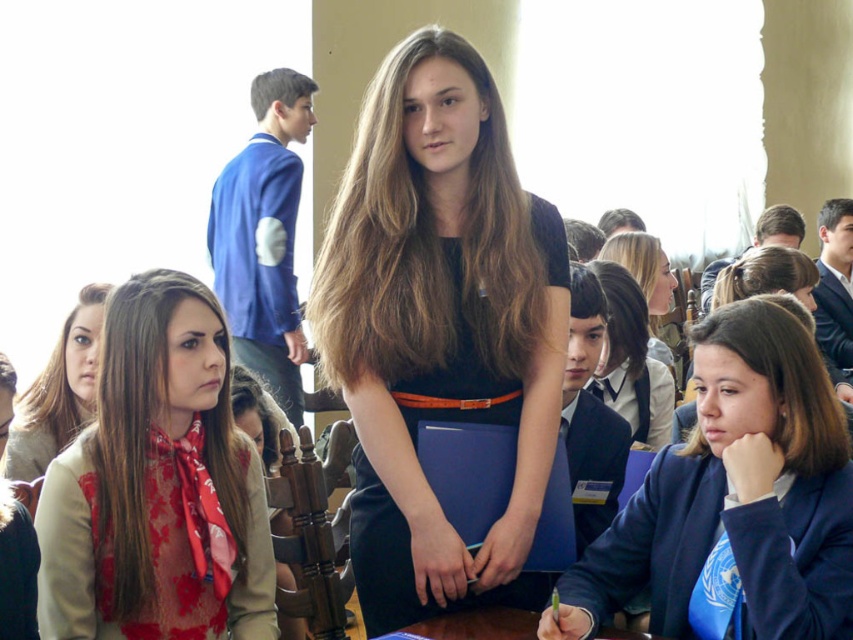
You are a photographer trying to capture a closeup of the central speaker while ensuring the beige fabric scarf at left and the matte beige scarf at left are visible in the frame. Which scarf should you focus on to ensure both are in focus?

The beige fabric scarf at left is closer to the viewer than the matte beige scarf at left, so focusing on it will ensure both are in focus.

You are a photographer in the back of the room. You want to take a photo of the black matte dress at center and the smooth blonde hair at center. Which object should you focus on first if you want to capture both in the same frame?

The black matte dress at center is positioned on the left side of smooth blonde hair at center, so you should focus on the black matte dress at center first to ensure both are in the frame.

You are organizing a photo shoot and need to ensure that the black matte dress at center and the smooth blonde hair at center are both visible in the frame. Given their sizes, which object should you focus on to ensure both are captured clearly?

The black matte dress at center is larger in size than smooth blonde hair at center, so focusing on the black matte dress at center will help ensure both objects are visible in the frame.